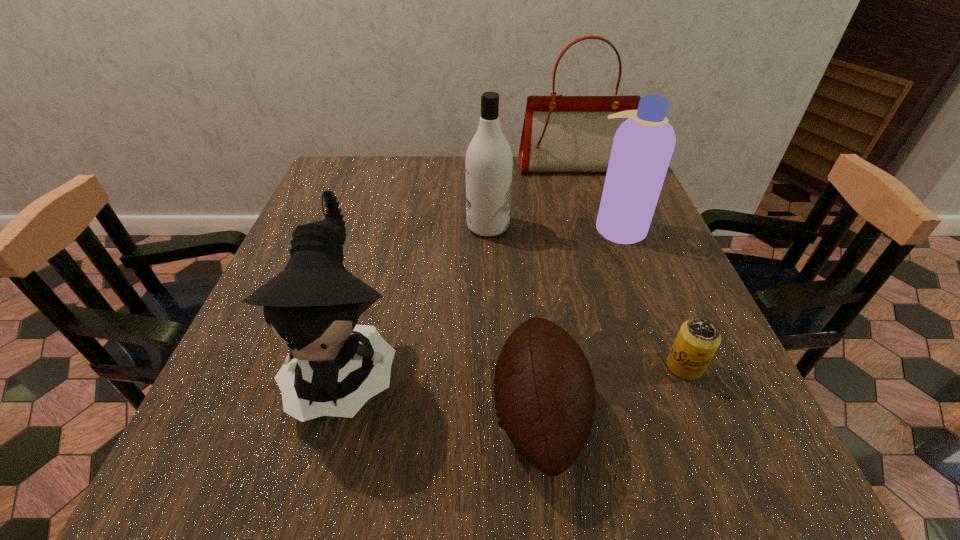
Locate an element on the screen. The width and height of the screenshot is (960, 540). free region that satisfies the following two spatial constraints: 1. on the front-facing side of the left shampoo; 2. on the back side of the shortest object is located at coordinates (491, 366).

Identify the location of free spot that satisfies the following two spatial constraints: 1. on the front-facing side of the right shampoo; 2. on the left side of the left shampoo. (488, 227).